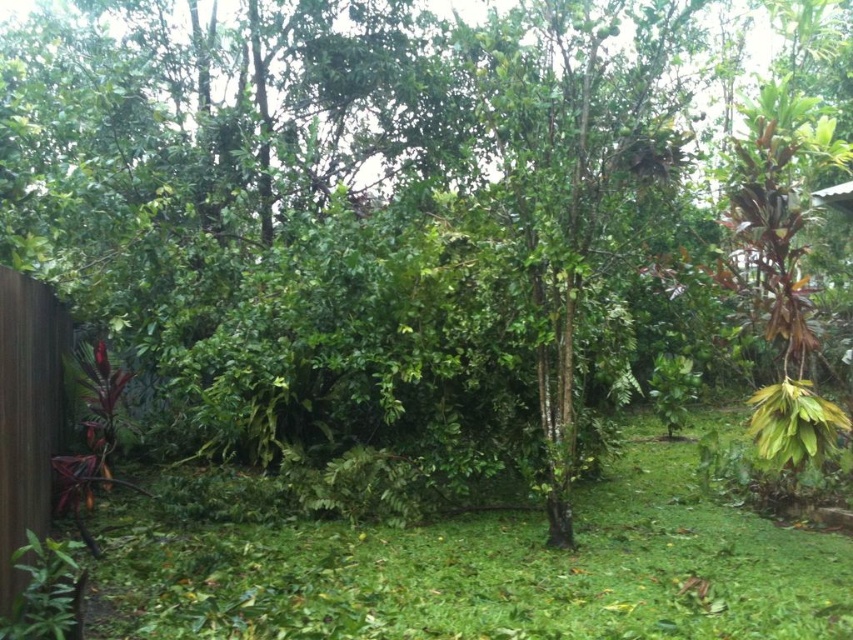
Question: Which point is closer to the camera?

Choices:
 (A) (50, 449)
 (B) (178, 604)

Answer: (B)

Question: From the image, what is the correct spatial relationship of green grass at lower left in relation to brown wood fence at left?

Choices:
 (A) left
 (B) right

Answer: (B)

Question: Does green grass at lower left have a larger size compared to brown wood fence at left?

Choices:
 (A) no
 (B) yes

Answer: (A)

Question: Does green grass at lower left have a smaller size compared to brown wood fence at left?

Choices:
 (A) no
 (B) yes

Answer: (B)